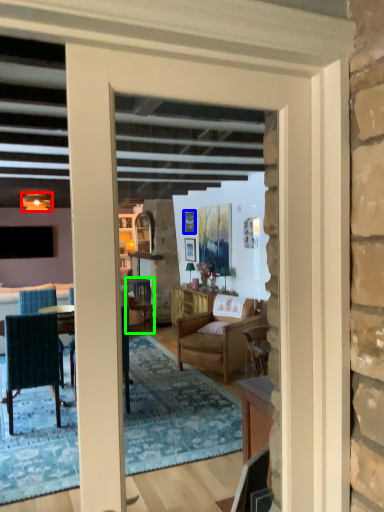
Question: Which object is positioned farthest from lamp (highlighted by a red box)? Select from picture frame (highlighted by a blue box) and chair (highlighted by a green box).

Choices:
 (A) picture frame
 (B) chair

Answer: (A)